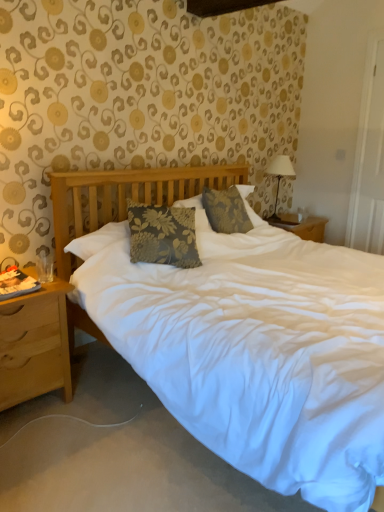
Question: Considering the relative sizes of floral fabric pillow at center and wooden nightstand at left in the image provided, is floral fabric pillow at center wider than wooden nightstand at left?

Choices:
 (A) no
 (B) yes

Answer: (A)

Question: Is floral fabric pillow at center smaller than wooden nightstand at left?

Choices:
 (A) no
 (B) yes

Answer: (B)

Question: From a real-world perspective, is floral fabric pillow at center beneath wooden nightstand at left?

Choices:
 (A) no
 (B) yes

Answer: (A)

Question: Is floral fabric pillow at center facing towards wooden nightstand at left?

Choices:
 (A) no
 (B) yes

Answer: (A)

Question: From a real-world perspective, is floral fabric pillow at center over wooden nightstand at left?

Choices:
 (A) yes
 (B) no

Answer: (A)

Question: Considering the relative sizes of floral fabric pillow at center and wooden nightstand at left in the image provided, is floral fabric pillow at center thinner than wooden nightstand at left?

Choices:
 (A) yes
 (B) no

Answer: (A)

Question: Is the depth of white fabric-covered lampshade at upper right greater than that of wooden nightstand at left?

Choices:
 (A) yes
 (B) no

Answer: (A)

Question: Considering the relative sizes of white fabric-covered lampshade at upper right and wooden nightstand at left in the image provided, is white fabric-covered lampshade at upper right taller than wooden nightstand at left?

Choices:
 (A) no
 (B) yes

Answer: (A)

Question: From a real-world perspective, is white fabric-covered lampshade at upper right physically below wooden nightstand at left?

Choices:
 (A) yes
 (B) no

Answer: (B)

Question: Is white fabric-covered lampshade at upper right placed right next to wooden nightstand at left?

Choices:
 (A) no
 (B) yes

Answer: (A)

Question: Could you tell me if white fabric-covered lampshade at upper right is turned towards wooden nightstand at left?

Choices:
 (A) no
 (B) yes

Answer: (A)

Question: From the image's perspective, is white fabric-covered lampshade at upper right below wooden nightstand at left?

Choices:
 (A) yes
 (B) no

Answer: (B)

Question: Does wooden nightstand at left have a greater height compared to white fabric-covered lampshade at upper right?

Choices:
 (A) yes
 (B) no

Answer: (A)